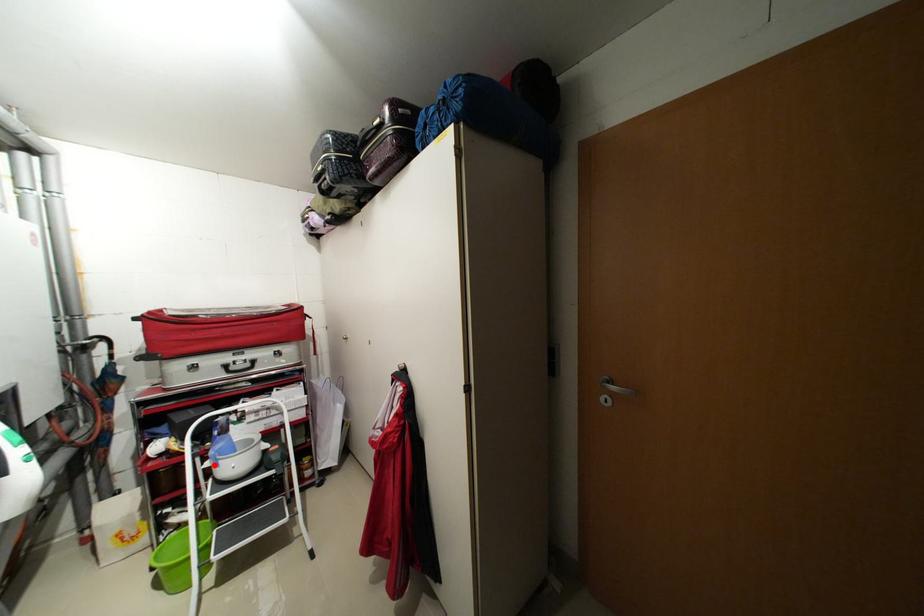
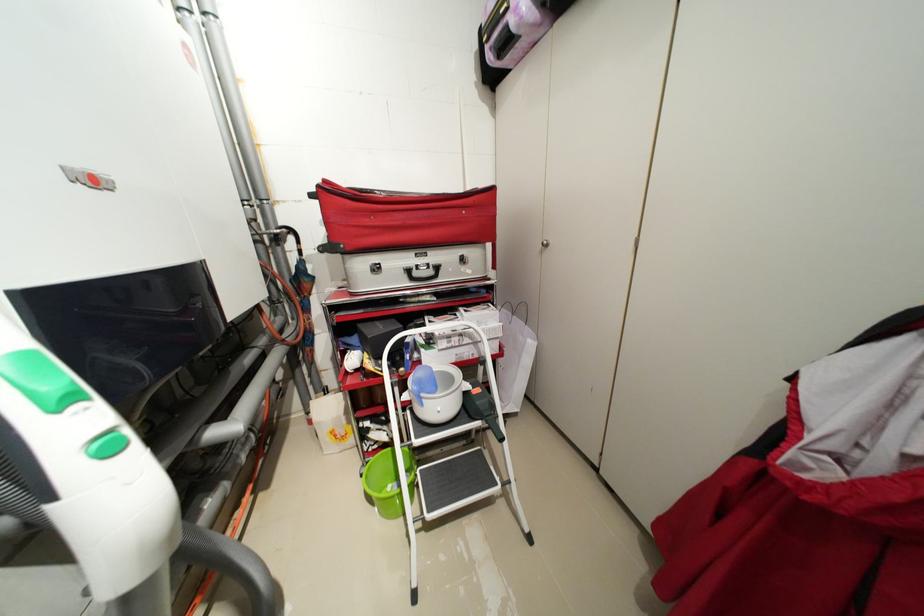
Locate, in the second image, the point that corresponds to the highlighted location in the first image.

(412, 398)